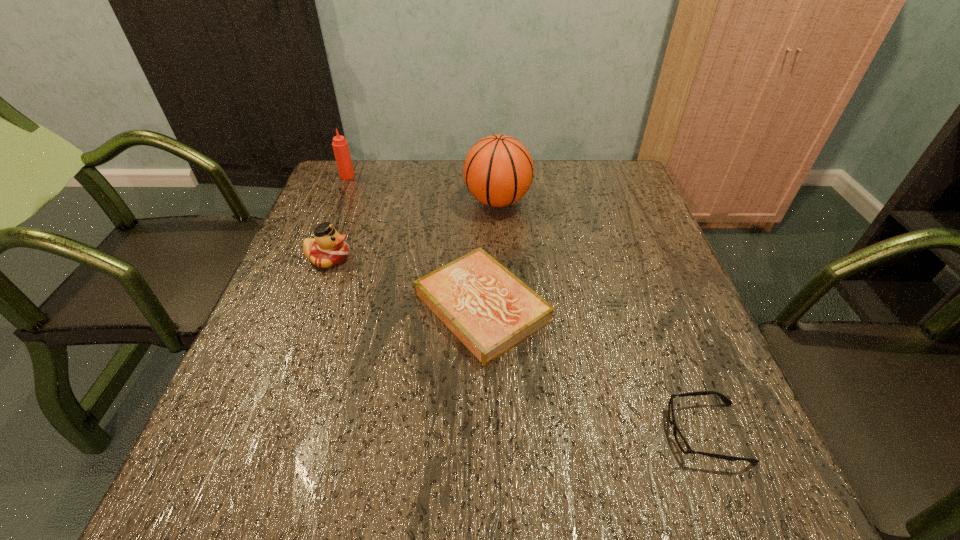
In order to click on vacant point located between the spectacles and the hardback book in this screenshot , I will do `click(594, 369)`.

This screenshot has height=540, width=960. I want to click on vacant space that is in between the Tabasco sauce and the third tallest object, so click(338, 217).

The width and height of the screenshot is (960, 540). What are the coordinates of `free space between the third tallest object and the spectacles` in the screenshot? It's located at [517, 345].

In order to click on vacant point located between the duck and the hardback book in this screenshot , I will do `click(405, 282)`.

This screenshot has height=540, width=960. What are the coordinates of `free space between the fourth shortest object and the hardback book` in the screenshot? It's located at tap(415, 241).

Image resolution: width=960 pixels, height=540 pixels. Identify the location of free space that is in between the basketball and the hardback book. (490, 254).

At what (x,y) coordinates should I click in order to perform the action: click on free space between the basketball and the duck. Please return your answer as a coordinate pair (x, y). Image resolution: width=960 pixels, height=540 pixels. Looking at the image, I should click on (413, 230).

You are a GUI agent. You are given a task and a screenshot of the screen. Output one action in this format:
    pyautogui.click(x=<x>, y=<y>)
    Task: Click on the blank region between the hardback book and the third tallest object
    The image size is (960, 540).
    Given the screenshot: What is the action you would take?
    pyautogui.click(x=405, y=282)

What are the coordinates of `vacant region between the duck and the farthest object` in the screenshot? It's located at (338, 217).

Identify which object is the third nearest to the second farthest object. Please provide its 2D coordinates. Your answer should be formatted as a tuple, i.e. [(x, y)], where the tuple contains the x and y coordinates of a point satisfying the conditions above.

[(340, 146)]